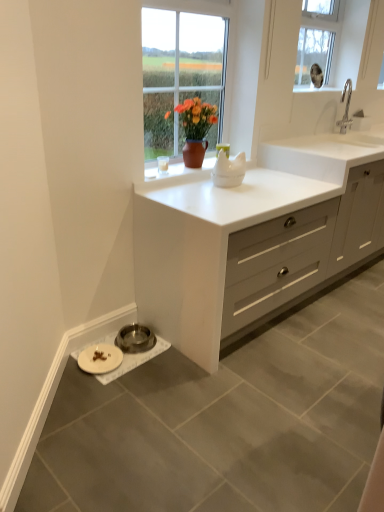
Locate an element on the screen. The width and height of the screenshot is (384, 512). free location in front of white ceramic sink at upper right is located at coordinates click(356, 137).